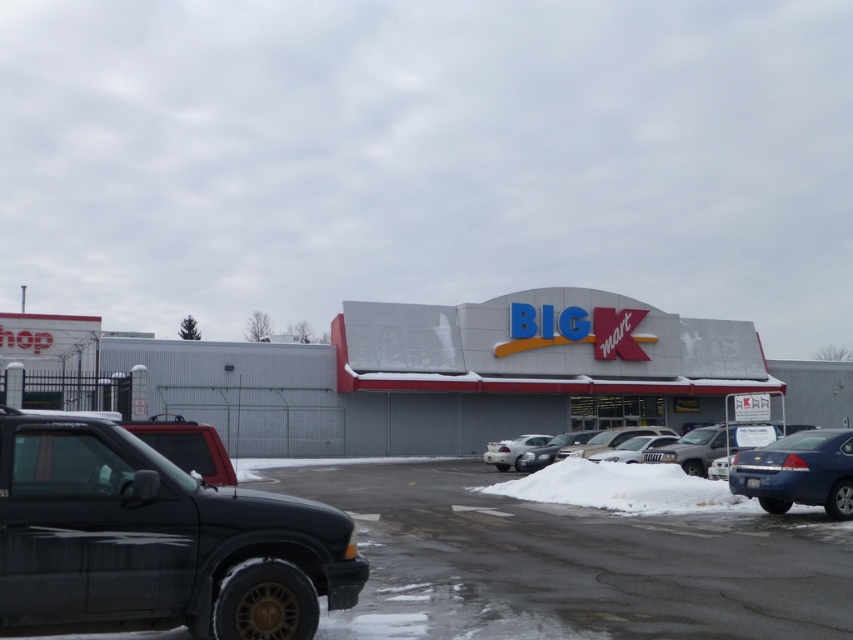
You are a delivery driver needing to park your 1.8 meters wide truck between the white matte sedan at center and the satin silver sedan at center in the parking lot. Can your truck fit in the space between them?

The white matte sedan at center is wider than the satin silver sedan at center. However, the exact distance between them isn

You are a delivery driver who needs to park your truck between the silver metallic sedan at center and the white matte sedan at center. Given that your truck is 2.5 meters wide, can you fit your truck in the space between them?

The silver metallic sedan at center is wider than the white matte sedan at center, but the exact width of the space between them isn

You are a delivery driver who needs to park your truck between the white matte sedan at center and the satin silver sedan at center in the parking lot. Can you fit your truck, which is 6 meters long, between them?

The white matte sedan at center is bigger than the satin silver sedan at center, but the exact distance between them is not provided. Without knowing the space between the two sedans, it is impossible to determine if the 6 meter truck can fit.